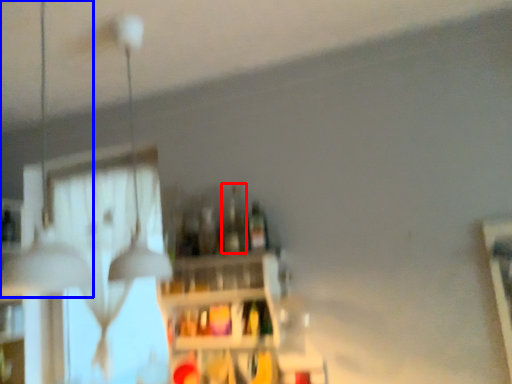
Question: Which object appears closest to the camera in this image, bottle (highlighted by a red box) or lamp (highlighted by a blue box)?

Choices:
 (A) bottle
 (B) lamp

Answer: (B)